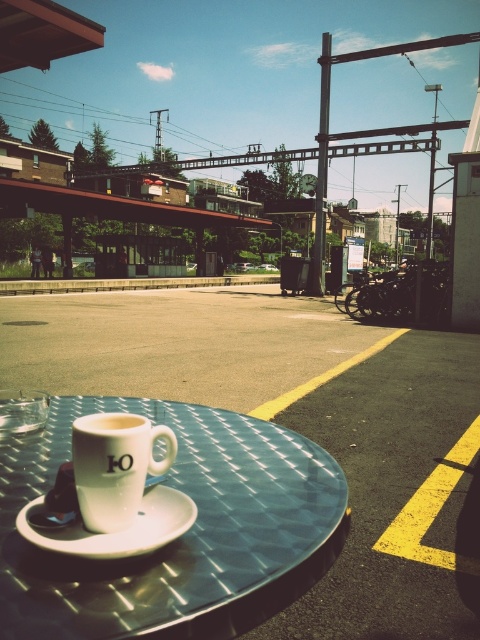
You are sitting at the metallic textured table at center and want to place the white matte mug at center on the table. Can the mug fit on the table without hanging over the edges?

The metallic textured table at center is larger in size than the white matte mug at center, so the mug can fit on the table without hanging over the edges.

You are sitting at the platform and want to place your phone on the metallic textured table at center and the white ceramic saucer at center. Which surface is closer to your right hand if your right hand is near the edge of the platform?

The metallic textured table at center is to the right of the white ceramic saucer at center, so it is closer to your right hand.

You are sitting at the platform and want to place your phone on the metallic textured table at center and the white matte mug at center. Which object should you place it on to keep it closer to the edge of the platform?

You should place your phone on the metallic textured table at center because it is to the right of the white matte mug at center, and since the platform edge is on the right side, it would be closer to the edge.